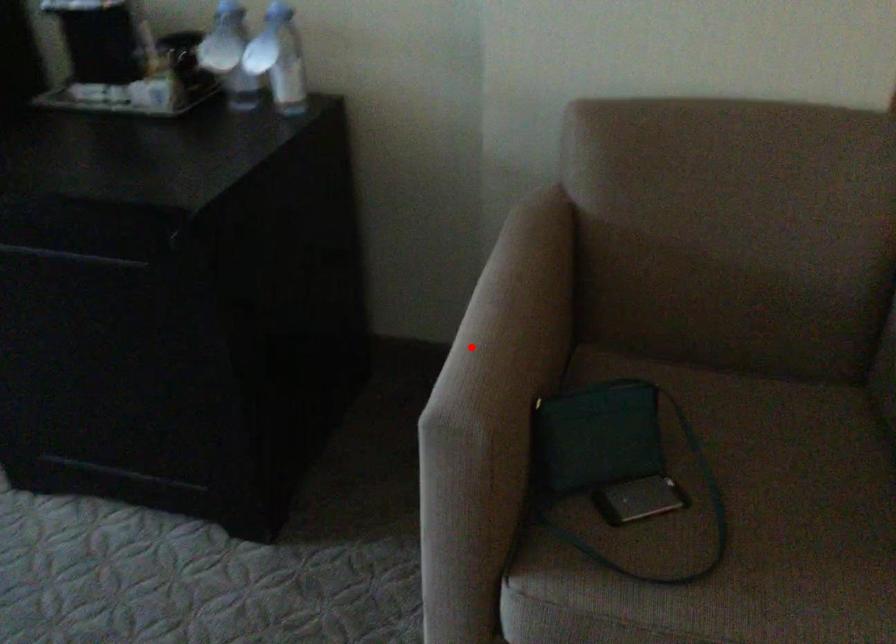
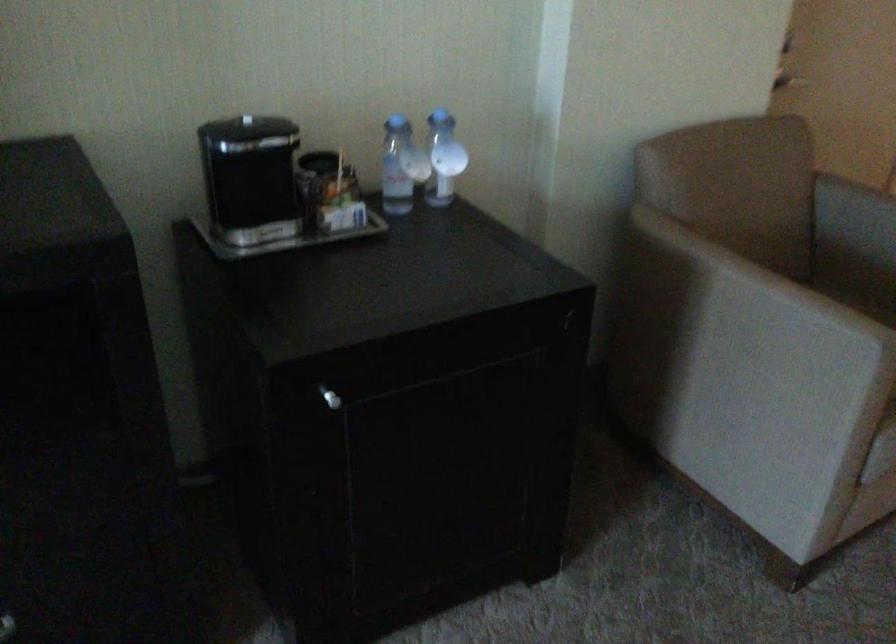
Question: I am providing you with two images of the same scene from different viewpoints. In image1, a red point is highlighted. Considering the same 3D point in image2, which of the following is correct?

Choices:
 (A) It is closer
 (B) It is farther

Answer: (B)